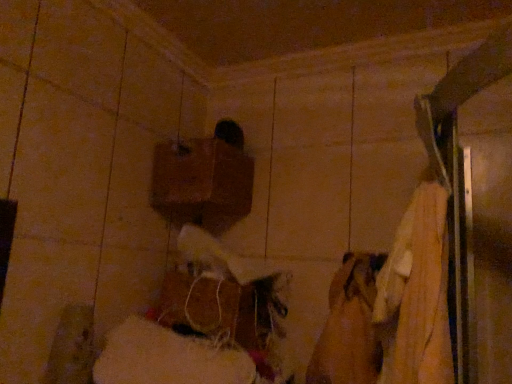
Describe the element at coordinates (222, 308) in the screenshot. I see `woodenmaterial/texture at center, the first wood positioned from the bottom` at that location.

I want to click on woodenmaterial/texture at center, the first wood positioned from the bottom, so click(222, 308).

In order to face brown matte wood at upper center, positioned as the 2th wood in bottom-to-top order, should I rotate leftwards or rightwards?

To face it directly, rotate left by 6.769 degrees.

Locate an element on the screen. The height and width of the screenshot is (384, 512). brown matte wood at upper center, marked as the 1th wood in a top-to-bottom arrangement is located at coordinates (201, 181).

What do you see at coordinates (201, 181) in the screenshot? I see `brown matte wood at upper center, marked as the 1th wood in a top-to-bottom arrangement` at bounding box center [201, 181].

Locate an element on the screen. Image resolution: width=512 pixels, height=384 pixels. woodenmaterial/texture at center, the first wood positioned from the bottom is located at coordinates (222, 308).

Is brown matte wood at upper center, positioned as the 2th wood in bottom-to-top order, to the right of woodenmaterial/texture at center, the first wood positioned from the bottom, from the viewer's perspective?

In fact, brown matte wood at upper center, positioned as the 2th wood in bottom-to-top order, is to the left of woodenmaterial/texture at center, the first wood positioned from the bottom.

Is the depth of brown matte wood at upper center, positioned as the 2th wood in bottom-to-top order, greater than that of woodenmaterial/texture at center, the first wood positioned from the bottom?

Yes, it is.

Considering the points (216, 210) and (222, 326), which point is in front, point (216, 210) or point (222, 326)?

Positioned in front is point (222, 326).

From the image's perspective, is brown matte wood at upper center, marked as the 1th wood in a top-to-bottom arrangement, under woodenmaterial/texture at center, the first wood positioned from the bottom?

No, from the image's perspective, brown matte wood at upper center, marked as the 1th wood in a top-to-bottom arrangement, is not beneath woodenmaterial/texture at center, the first wood positioned from the bottom.

From a real-world perspective, which object rests below the other?

From a 3D spatial view, woodenmaterial/texture at center, which ranks as the second wood in top-to-bottom order, is below.

Between brown matte wood at upper center, positioned as the 2th wood in bottom-to-top order, and woodenmaterial/texture at center, which ranks as the second wood in top-to-bottom order, which one has larger width?

brown matte wood at upper center, positioned as the 2th wood in bottom-to-top order.

Considering the sizes of objects brown matte wood at upper center, marked as the 1th wood in a top-to-bottom arrangement, and woodenmaterial/texture at center, which ranks as the second wood in top-to-bottom order, in the image provided, who is taller, brown matte wood at upper center, marked as the 1th wood in a top-to-bottom arrangement, or woodenmaterial/texture at center, which ranks as the second wood in top-to-bottom order,?

With more height is brown matte wood at upper center, marked as the 1th wood in a top-to-bottom arrangement.

Can you confirm if brown matte wood at upper center, positioned as the 2th wood in bottom-to-top order, is smaller than woodenmaterial/texture at center, which ranks as the second wood in top-to-bottom order?

Yes, brown matte wood at upper center, positioned as the 2th wood in bottom-to-top order, is smaller than woodenmaterial/texture at center, which ranks as the second wood in top-to-bottom order.

Is brown matte wood at upper center, marked as the 1th wood in a top-to-bottom arrangement, situated inside woodenmaterial/texture at center, which ranks as the second wood in top-to-bottom order, or outside?

brown matte wood at upper center, marked as the 1th wood in a top-to-bottom arrangement, is outside woodenmaterial/texture at center, which ranks as the second wood in top-to-bottom order.

Is brown matte wood at upper center, positioned as the 2th wood in bottom-to-top order, touching woodenmaterial/texture at center, the first wood positioned from the bottom?

No, brown matte wood at upper center, positioned as the 2th wood in bottom-to-top order, is not touching woodenmaterial/texture at center, the first wood positioned from the bottom.

Is brown matte wood at upper center, marked as the 1th wood in a top-to-bottom arrangement, facing away from woodenmaterial/texture at center, the first wood positioned from the bottom?

brown matte wood at upper center, marked as the 1th wood in a top-to-bottom arrangement, does not have its back to woodenmaterial/texture at center, the first wood positioned from the bottom.

How many degrees apart are the facing directions of brown matte wood at upper center, marked as the 1th wood in a top-to-bottom arrangement, and woodenmaterial/texture at center, the first wood positioned from the bottom?

They differ by 4.79e-05 degrees in their facing directions.

At what (x,y) coordinates should I click in order to perform the action: click on wood in front of the brown matte wood at upper center, marked as the 1th wood in a top-to-bottom arrangement. Please return your answer as a coordinate pair (x, y). This screenshot has width=512, height=384. Looking at the image, I should click on (222, 308).

Considering the relative positions of woodenmaterial/texture at center, the first wood positioned from the bottom, and brown matte wood at upper center, marked as the 1th wood in a top-to-bottom arrangement, in the image provided, is woodenmaterial/texture at center, the first wood positioned from the bottom, to the left or to the right of brown matte wood at upper center, marked as the 1th wood in a top-to-bottom arrangement,?

In the image, woodenmaterial/texture at center, the first wood positioned from the bottom, appears on the right side of brown matte wood at upper center, marked as the 1th wood in a top-to-bottom arrangement.

Is woodenmaterial/texture at center, which ranks as the second wood in top-to-bottom order, in front of or behind brown matte wood at upper center, positioned as the 2th wood in bottom-to-top order, in the image?

Visually, woodenmaterial/texture at center, which ranks as the second wood in top-to-bottom order, is located in front of brown matte wood at upper center, positioned as the 2th wood in bottom-to-top order.

Which is closer to the camera, (x=201, y=316) or (x=249, y=167)?

The point (x=201, y=316) is closer.

From the image's perspective, is woodenmaterial/texture at center, which ranks as the second wood in top-to-bottom order, located above brown matte wood at upper center, marked as the 1th wood in a top-to-bottom arrangement?

No.

From a real-world perspective, is woodenmaterial/texture at center, the first wood positioned from the bottom, on brown matte wood at upper center, positioned as the 2th wood in bottom-to-top order?

No, from a real-world perspective, woodenmaterial/texture at center, the first wood positioned from the bottom, is not over brown matte wood at upper center, positioned as the 2th wood in bottom-to-top order

Which of these two, woodenmaterial/texture at center, the first wood positioned from the bottom, or brown matte wood at upper center, positioned as the 2th wood in bottom-to-top order, is wider?

brown matte wood at upper center, positioned as the 2th wood in bottom-to-top order.

Is woodenmaterial/texture at center, the first wood positioned from the bottom, taller or shorter than brown matte wood at upper center, positioned as the 2th wood in bottom-to-top order?

Considering their sizes, woodenmaterial/texture at center, the first wood positioned from the bottom, has less height than brown matte wood at upper center, positioned as the 2th wood in bottom-to-top order.

Which of these two, woodenmaterial/texture at center, which ranks as the second wood in top-to-bottom order, or brown matte wood at upper center, marked as the 1th wood in a top-to-bottom arrangement, is bigger?

woodenmaterial/texture at center, which ranks as the second wood in top-to-bottom order.

Is woodenmaterial/texture at center, which ranks as the second wood in top-to-bottom order, completely or partially outside of brown matte wood at upper center, positioned as the 2th wood in bottom-to-top order?

woodenmaterial/texture at center, which ranks as the second wood in top-to-bottom order, lies outside brown matte wood at upper center, positioned as the 2th wood in bottom-to-top order,'s area.

Can you see woodenmaterial/texture at center, which ranks as the second wood in top-to-bottom order, touching brown matte wood at upper center, positioned as the 2th wood in bottom-to-top order?

They are not placed beside each other.

Is woodenmaterial/texture at center, which ranks as the second wood in top-to-bottom order, oriented away from brown matte wood at upper center, positioned as the 2th wood in bottom-to-top order?

No.

Where is `wood below the brown matte wood at upper center, marked as the 1th wood in a top-to-bottom arrangement (from a real-world perspective)`? This screenshot has width=512, height=384. wood below the brown matte wood at upper center, marked as the 1th wood in a top-to-bottom arrangement (from a real-world perspective) is located at coordinates (222, 308).

Image resolution: width=512 pixels, height=384 pixels. I want to click on wood lying on the left of woodenmaterial/texture at center, the first wood positioned from the bottom, so click(201, 181).

The image size is (512, 384). In order to click on wood located in front of the brown matte wood at upper center, positioned as the 2th wood in bottom-to-top order in this screenshot , I will do `click(222, 308)`.